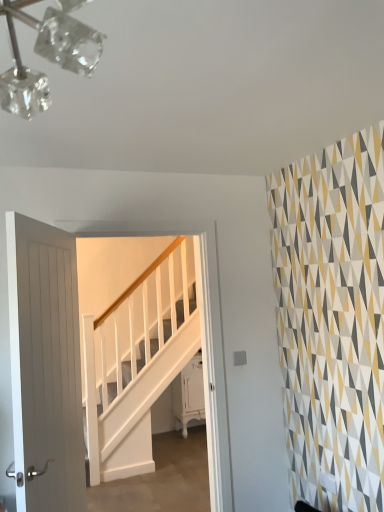
Question: Is white glossy cabinet at lower center not within white wooden stairs at center?

Choices:
 (A) no
 (B) yes

Answer: (B)

Question: Are white glossy cabinet at lower center and white wooden stairs at center far apart?

Choices:
 (A) yes
 (B) no

Answer: (B)

Question: Is white glossy cabinet at lower center closer to the viewer compared to white wooden stairs at center?

Choices:
 (A) yes
 (B) no

Answer: (B)

Question: Is white glossy cabinet at lower center surrounding white wooden stairs at center?

Choices:
 (A) no
 (B) yes

Answer: (A)

Question: Is white glossy cabinet at lower center looking in the opposite direction of white wooden stairs at center?

Choices:
 (A) no
 (B) yes

Answer: (A)

Question: From the image's perspective, is white glossy cabinet at lower center below white wooden stairs at center?

Choices:
 (A) yes
 (B) no

Answer: (A)

Question: Considering the relative positions of white wooden stairs at center and white wooden door at left in the image provided, is white wooden stairs at center to the right of white wooden door at left from the viewer's perspective?

Choices:
 (A) yes
 (B) no

Answer: (A)

Question: Is white wooden stairs at center to the left of white wooden door at left from the viewer's perspective?

Choices:
 (A) yes
 (B) no

Answer: (B)

Question: Does white wooden stairs at center have a lesser width compared to white wooden door at left?

Choices:
 (A) no
 (B) yes

Answer: (B)

Question: Is white wooden stairs at center bigger than white wooden door at left?

Choices:
 (A) yes
 (B) no

Answer: (A)

Question: Is white wooden stairs at center taller than white wooden door at left?

Choices:
 (A) no
 (B) yes

Answer: (B)

Question: Considering the relative sizes of white wooden stairs at center and white wooden door at left in the image provided, is white wooden stairs at center wider than white wooden door at left?

Choices:
 (A) yes
 (B) no

Answer: (B)

Question: From the image's perspective, would you say white wooden door at left is positioned over white glossy cabinet at lower center?

Choices:
 (A) yes
 (B) no

Answer: (A)